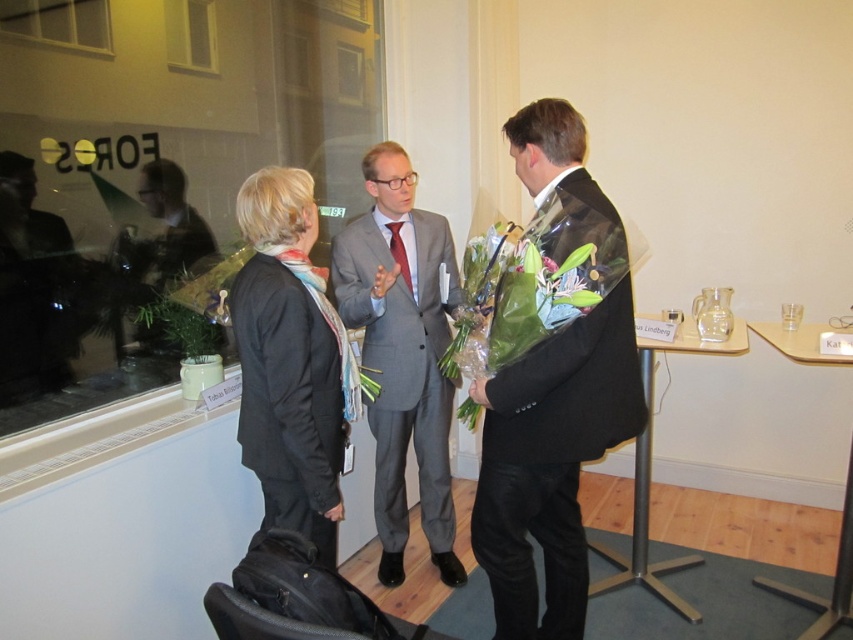
You are an interior designer assessing the layout of this formal event space. You notice the black matte suit at right and the clear glass window at upper left. Which object occupies a larger vertical space in the scene?

The black matte suit at right has a greater height compared to the clear glass window at upper left, so it occupies a larger vertical space in the scene.

You are a photographer at the event and need to adjust your camera focus to capture the black matte suit at right. The camera can only focus on objects within a 0.1 unit radius around the specified point. Is the black matte suit at right within the focus range of point (550, 461)?

The black matte suit at right is located exactly at point (550, 461), so it is within the camera focus range of 0.1 unit radius around that point. The camera can focus on it successfully.

You are a photographer at this event and need to position yourself so that both the black matte suit at right and the clear glass window at upper left are visible in your shot. Based on their positions, where should you stand relative to these objects?

To capture both the black matte suit at right and the clear glass window at upper left in your shot, you should position yourself in a way that the black matte suit at right is below the clear glass window at upper left, so standing to the left or center of the scene would allow both to be framed appropriately.